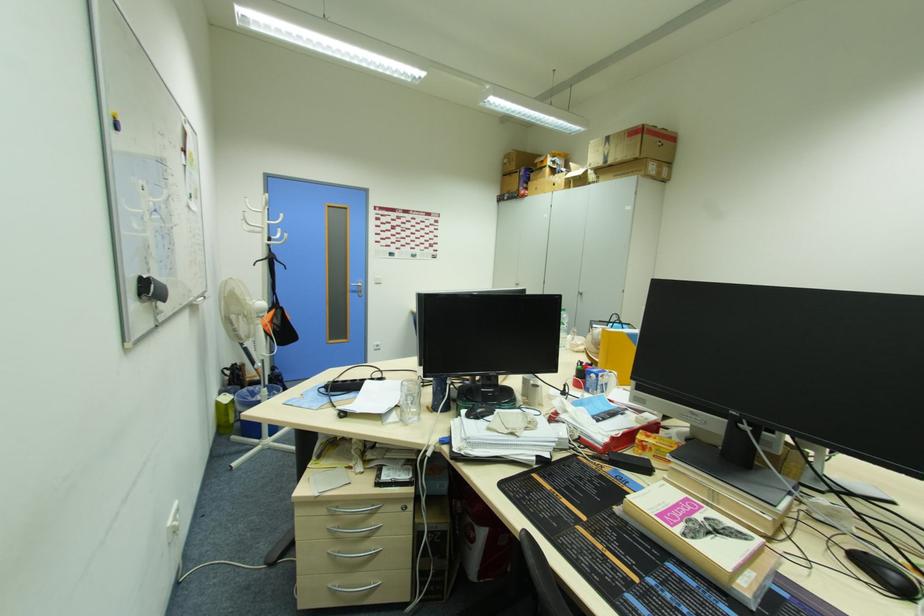
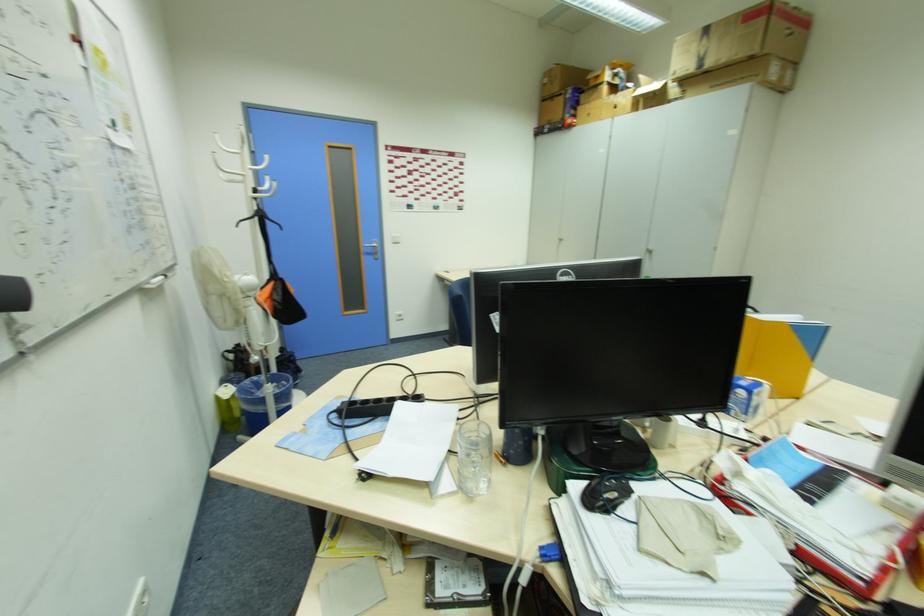
In the second image, find the point that corresponds to (282,331) in the first image.

(283, 309)